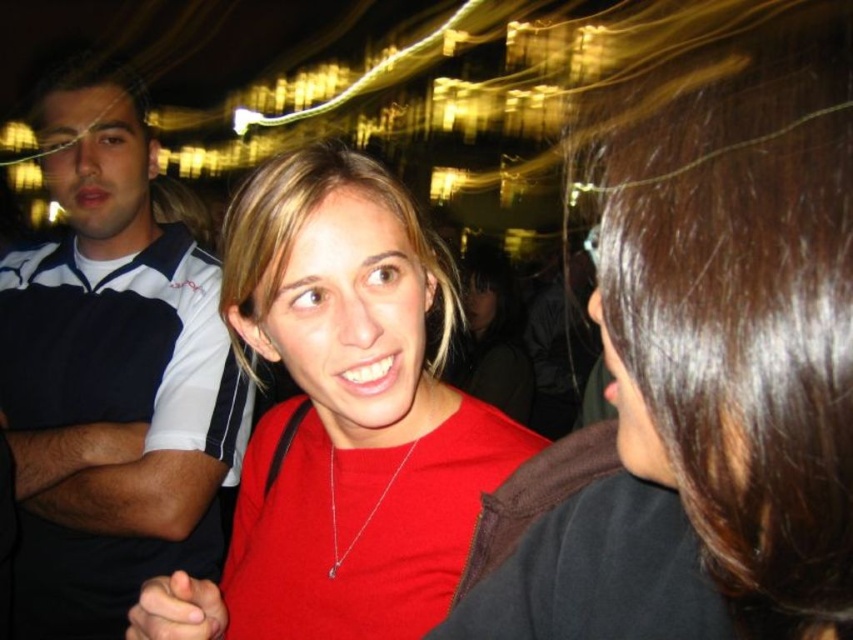
Who is shorter, shiny brown hair at upper right or matte red shirt at center?

With less height is shiny brown hair at upper right.

Where is `shiny brown hair at upper right`? This screenshot has width=853, height=640. shiny brown hair at upper right is located at coordinates pyautogui.click(x=746, y=314).

You are a GUI agent. You are given a task and a screenshot of the screen. Output one action in this format:
    pyautogui.click(x=<x>, y=<y>)
    Task: Click on the shiny brown hair at upper right
    The image size is (853, 640).
    Given the screenshot: What is the action you would take?
    pyautogui.click(x=746, y=314)

Find the location of `shiny brown hair at upper right`. shiny brown hair at upper right is located at coordinates (746, 314).

Is matte red shirt at center to the right of white and navy polo shirt at left from the viewer's perspective?

Yes, matte red shirt at center is to the right of white and navy polo shirt at left.

Is point (248, 452) behind point (38, 588)?

Yes, it is behind point (38, 588).

Measure the distance between point (363, 291) and camera.

Point (363, 291) is 32.42 meters away from camera.

Where is `matte red shirt at center`? matte red shirt at center is located at coordinates (347, 412).

Based on the photo, who is taller, shiny brown hair at upper right or white and navy polo shirt at left?

white and navy polo shirt at left

Does shiny brown hair at upper right appear over white and navy polo shirt at left?

Indeed, shiny brown hair at upper right is positioned over white and navy polo shirt at left.

What do you see at coordinates (746, 314) in the screenshot? I see `shiny brown hair at upper right` at bounding box center [746, 314].

Where is `shiny brown hair at upper right`? The height and width of the screenshot is (640, 853). shiny brown hair at upper right is located at coordinates (746, 314).